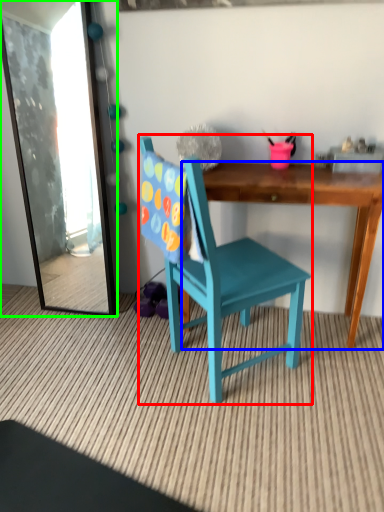
Question: Which object is positioned farthest from chair (highlighted by a red box)? Select from desk (highlighted by a blue box) and mirror (highlighted by a green box).

Choices:
 (A) desk
 (B) mirror

Answer: (B)